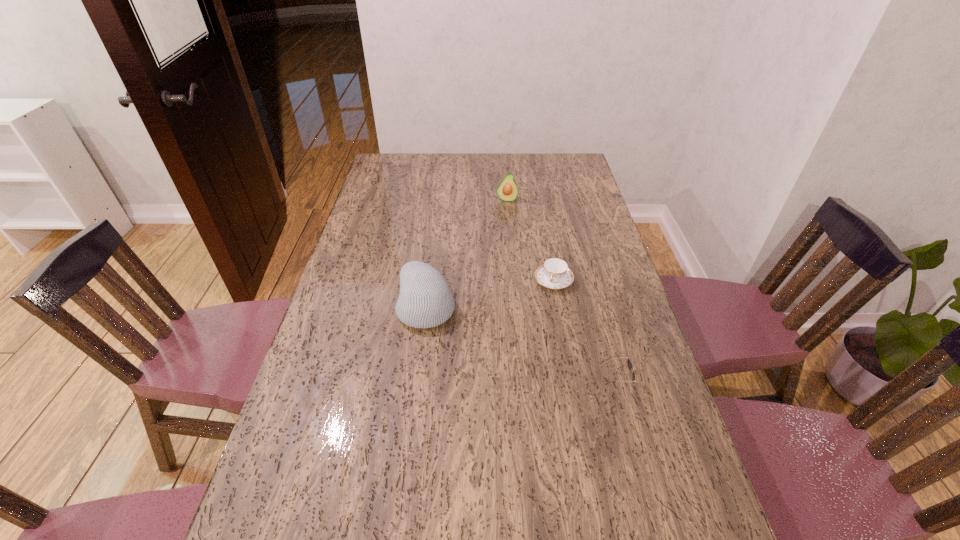
Locate an element on the screen. The width and height of the screenshot is (960, 540). free space at the far right corner is located at coordinates (547, 159).

This screenshot has height=540, width=960. Find the location of `vacant space in between the sunglasses and the shortest object`. vacant space in between the sunglasses and the shortest object is located at coordinates (584, 333).

The image size is (960, 540). I want to click on vacant space that's between the leftmost object and the third object from left to right, so click(x=490, y=293).

The width and height of the screenshot is (960, 540). Find the location of `free area in between the third tallest object and the beanie`. free area in between the third tallest object and the beanie is located at coordinates (520, 346).

This screenshot has width=960, height=540. Find the location of `vacant area that lies between the second object from left to right and the sunglasses`. vacant area that lies between the second object from left to right and the sunglasses is located at coordinates (561, 292).

This screenshot has width=960, height=540. Identify the location of empty location between the rightmost object and the leftmost object. (520, 346).

Find the location of a particular element. The width and height of the screenshot is (960, 540). free space between the avocado and the leftmost object is located at coordinates (467, 253).

Where is `empty space between the rightmost object and the third object from right to left`? This screenshot has height=540, width=960. empty space between the rightmost object and the third object from right to left is located at coordinates (561, 292).

Find the location of a particular element. This screenshot has width=960, height=540. blank region between the farthest object and the shortest object is located at coordinates (530, 240).

The height and width of the screenshot is (540, 960). In order to click on free area in between the leftmost object and the nearest object in this screenshot , I will do `click(520, 346)`.